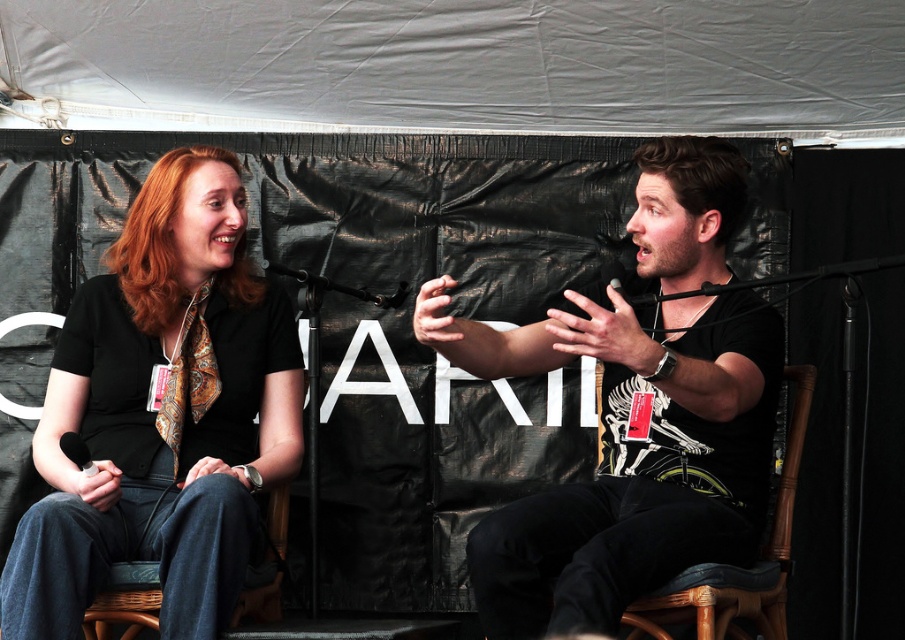
Is the position of denim fabric chair at lower left less distant than that of black matte microphone at center?

Yes, denim fabric chair at lower left is closer to the viewer.

Does denim fabric chair at lower left have a lesser height compared to black matte microphone at center?

No, denim fabric chair at lower left is not shorter than black matte microphone at center.

Where is `denim fabric chair at lower left`? denim fabric chair at lower left is located at coordinates (125, 602).

This screenshot has width=905, height=640. Describe the element at coordinates (625, 452) in the screenshot. I see `black matte t-shirt at center` at that location.

Which is more to the left, black matte t-shirt at center or denim fabric chair at lower left?

From the viewer's perspective, denim fabric chair at lower left appears more on the left side.

Which is behind, point (672, 440) or point (281, 490)?

The point (281, 490) is more distant.

This screenshot has height=640, width=905. In order to click on black matte t-shirt at center in this screenshot , I will do `click(625, 452)`.

Is point (101, 573) closer to camera compared to point (319, 276)?

Yes, point (101, 573) is closer to viewer.

Who is more forward, (196, 515) or (268, 260)?

Point (196, 515)

Is point (233, 545) less distant than point (380, 301)?

Yes, it is in front of point (380, 301).

You are a GUI agent. You are given a task and a screenshot of the screen. Output one action in this format:
    pyautogui.click(x=<x>, y=<y>)
    Task: Click on the matte black shirt at center
    This screenshot has width=905, height=640.
    Given the screenshot: What is the action you would take?
    pyautogui.click(x=162, y=413)